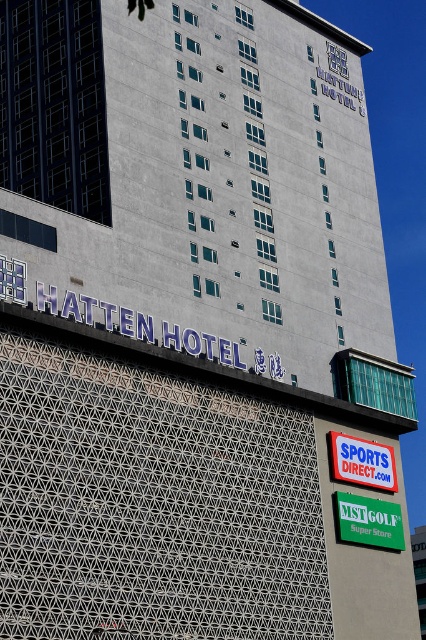
Question: From the image, what is the correct spatial relationship of green plastic mst golf super store sign at lower right in relation to blue plastic signboard at lower right?

Choices:
 (A) below
 (B) above

Answer: (A)

Question: Can you confirm if green plastic mst golf super store sign at lower right is positioned to the right of blue plastic signboard at lower right?

Choices:
 (A) yes
 (B) no

Answer: (A)

Question: Is green plastic mst golf super store sign at lower right bigger than blue plastic signboard at lower right?

Choices:
 (A) no
 (B) yes

Answer: (B)

Question: Which of the following is the closest to the observer?

Choices:
 (A) blue plastic signboard at lower right
 (B) green plastic mst golf super store sign at lower right

Answer: (B)